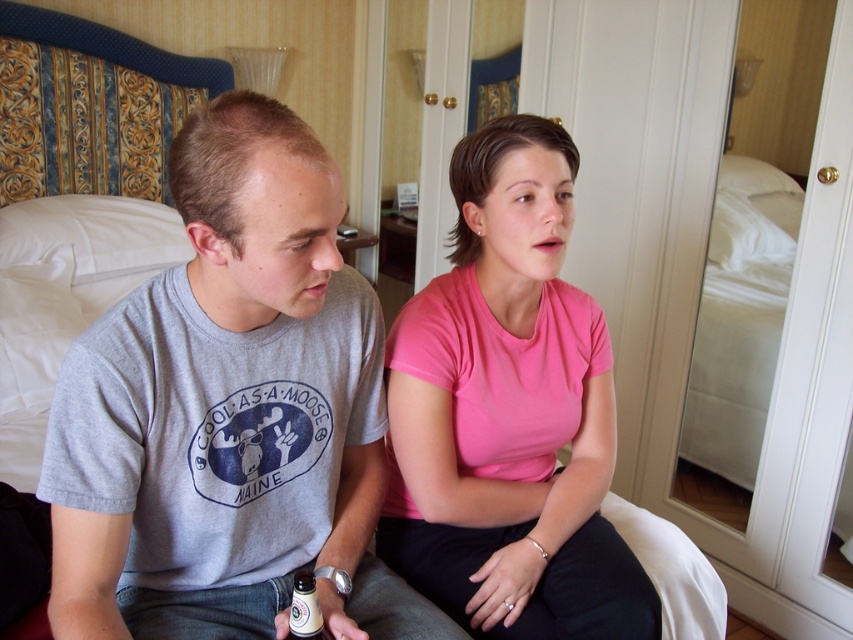
You are standing in the hotel room and want to take a photo of both the point at coordinates point (222, 579) and point (300, 586). Which point should you focus on first to ensure both are in focus?

You should focus on point (222, 579) first because it is closer to the camera than point (300, 586). By focusing on the closer point, the farther point will also be within the depth of field.